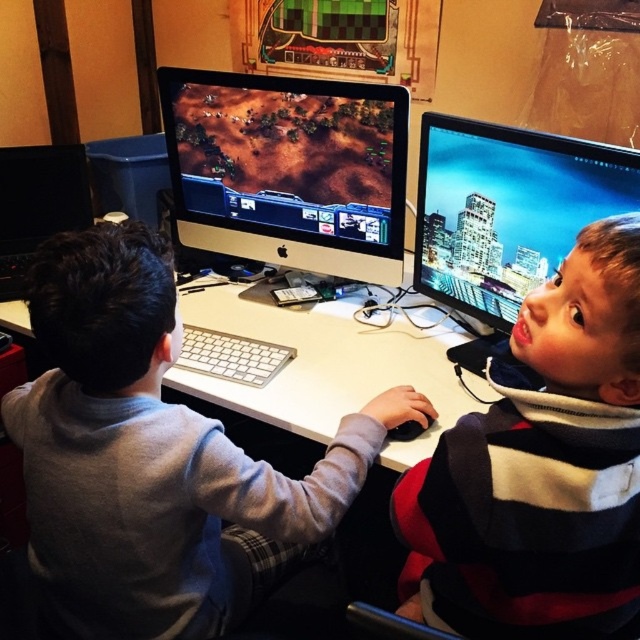
Is matte black monitor at center closer to the viewer compared to black glossy monitor at left?

Yes, matte black monitor at center is in front of black glossy monitor at left.

Is matte black monitor at center positioned behind black glossy monitor at left?

No, matte black monitor at center is in front of black glossy monitor at left.

Is point (211, 196) positioned before point (35, 237)?

Yes, it is in front of point (35, 237).

The image size is (640, 640). I want to click on matte black monitor at center, so click(x=289, y=170).

Is point (500, 534) closer to viewer compared to point (269, 376)?

Yes, it is in front of point (269, 376).

Which is in front, point (540, 577) or point (273, 371)?

Point (540, 577) is more forward.

Find the location of `striped sweater at upper right`. striped sweater at upper right is located at coordinates (540, 468).

Who is higher up, gray fleece sweatshirt at center or matte black monitor at center?

matte black monitor at center is above.

Does gray fleece sweatshirt at center appear on the left side of matte black monitor at center?

Indeed, gray fleece sweatshirt at center is positioned on the left side of matte black monitor at center.

Between point (148, 257) and point (196, 202), which one is positioned behind?

Point (196, 202)

Where is `gray fleece sweatshirt at center`? gray fleece sweatshirt at center is located at coordinates (156, 460).